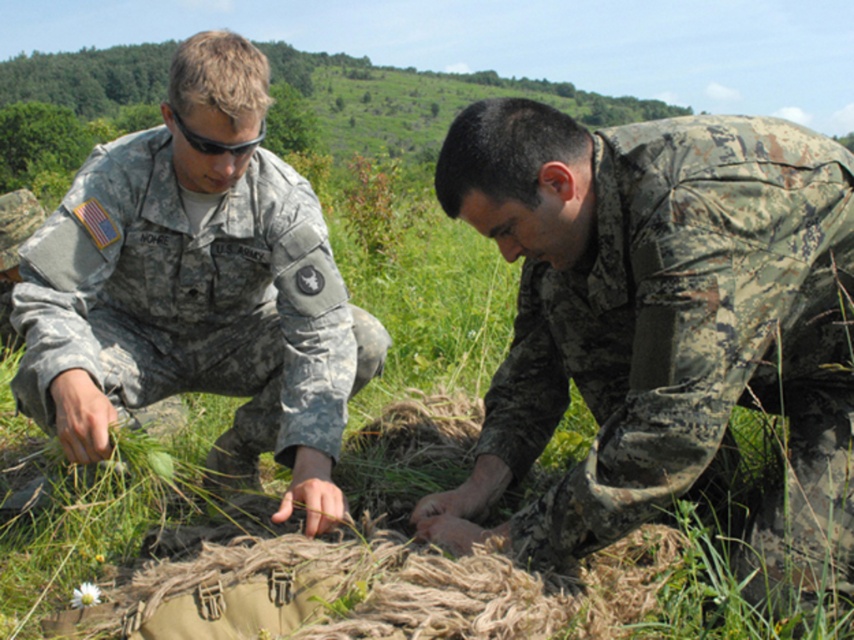
Question: Which of the following is the closest to the observer?

Choices:
 (A) camouflage uniform at left
 (B) camouflage fabric at center

Answer: (B)

Question: Which object is closer to the camera taking this photo?

Choices:
 (A) camouflage uniform at left
 (B) camouflage fabric at center
 (C) black matte sunglasses at upper center

Answer: (B)

Question: Can you confirm if camouflage fabric at center is wider than black matte sunglasses at upper center?

Choices:
 (A) no
 (B) yes

Answer: (B)

Question: Can you confirm if camouflage uniform at left is positioned below black matte sunglasses at upper center?

Choices:
 (A) no
 (B) yes

Answer: (B)

Question: Is camouflage fabric at center smaller than black matte sunglasses at upper center?

Choices:
 (A) no
 (B) yes

Answer: (A)

Question: Which is nearer to the camouflage uniform at left?

Choices:
 (A) camouflage fabric at center
 (B) black matte sunglasses at upper center

Answer: (B)